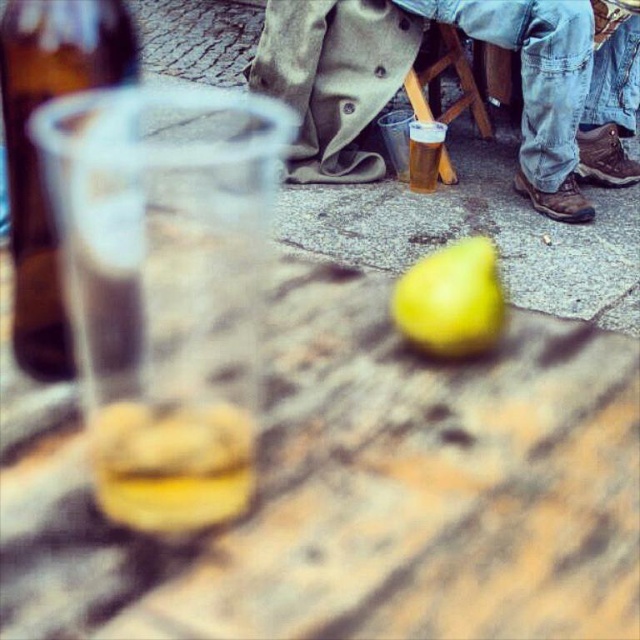
Question: Which point is farther from the camera taking this photo?

Choices:
 (A) (467, 19)
 (B) (444, 394)
 (C) (460, 262)

Answer: (A)

Question: Considering the relative positions of wooden table at center and translucent plastic cup at center in the image provided, where is wooden table at center located with respect to translucent plastic cup at center?

Choices:
 (A) left
 (B) right

Answer: (A)

Question: Is wooden table at center to the left of translucent plastic cup at center from the viewer's perspective?

Choices:
 (A) no
 (B) yes

Answer: (B)

Question: Does denim pants at lower right have a smaller size compared to translucent plastic cup at center?

Choices:
 (A) yes
 (B) no

Answer: (B)

Question: Which point appears farthest from the camera in this image?

Choices:
 (A) (577, 81)
 (B) (424, 328)

Answer: (A)

Question: Which object is farther from the camera taking this photo?

Choices:
 (A) brown glass bottle at left
 (B) translucent plastic cup at center
 (C) denim pants at lower right

Answer: (B)